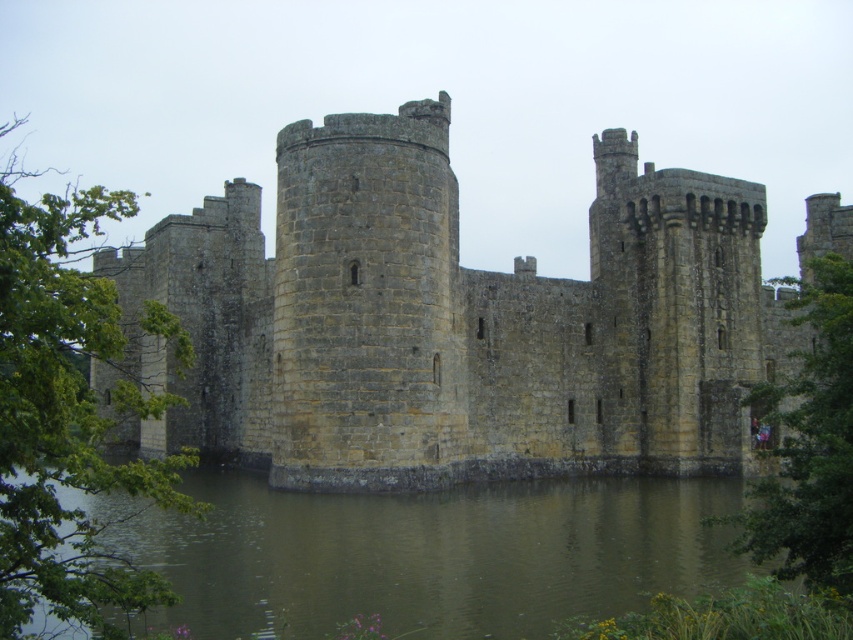
Question: Which object appears farthest from the camera in this image?

Choices:
 (A) stone castle at center
 (B) brown stone water at lower center

Answer: (A)

Question: Can you confirm if stone castle at center is smaller than brown stone water at lower center?

Choices:
 (A) yes
 (B) no

Answer: (B)

Question: Can you confirm if stone castle at center is positioned above brown stone water at lower center?

Choices:
 (A) yes
 (B) no

Answer: (A)

Question: Which of the following is the farthest from the observer?

Choices:
 (A) (161, 621)
 (B) (343, 228)

Answer: (B)

Question: Which object is closer to the camera taking this photo?

Choices:
 (A) stone castle at center
 (B) brown stone water at lower center

Answer: (B)

Question: In this image, where is stone castle at center located relative to brown stone water at lower center?

Choices:
 (A) left
 (B) right

Answer: (B)